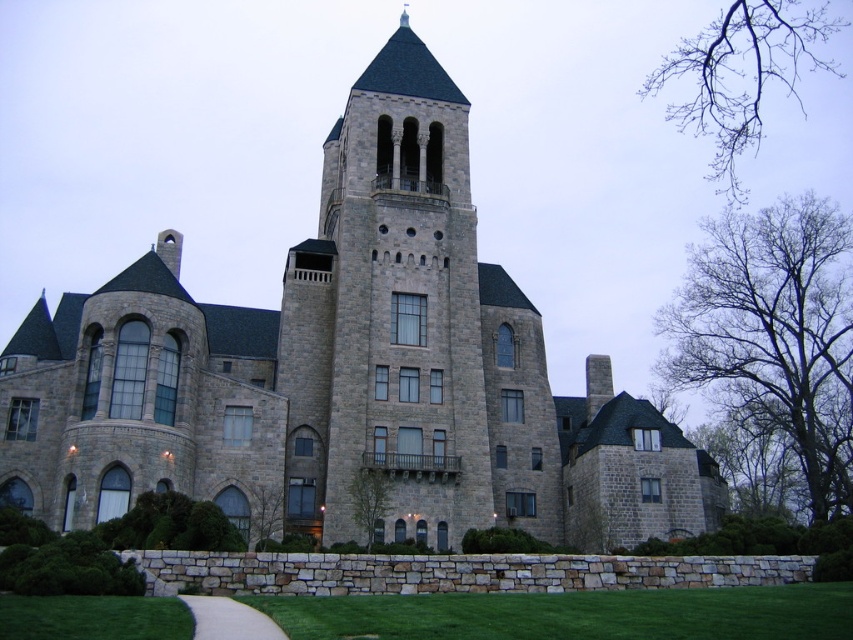
Is point (244, 516) farther from camera compared to point (405, 397)?

No, (244, 516) is closer to viewer.

Does gray stone castle at center appear on the right side of gray stone tower at center?

No, gray stone castle at center is not to the right of gray stone tower at center.

This screenshot has width=853, height=640. What do you see at coordinates (345, 372) in the screenshot?
I see `gray stone castle at center` at bounding box center [345, 372].

At what (x,y) coordinates should I click in order to perform the action: click on gray stone castle at center. Please return your answer as a coordinate pair (x, y). The width and height of the screenshot is (853, 640). Looking at the image, I should click on (345, 372).

Does gray stone tower at center have a smaller size compared to white gravel path at lower center?

Actually, gray stone tower at center might be larger than white gravel path at lower center.

Between point (407, 124) and point (271, 627), which one is positioned in front?

Point (271, 627)

Find the location of a particular element. This screenshot has width=853, height=640. gray stone tower at center is located at coordinates (402, 300).

Who is more distant from viewer, (631,436) or (194,634)?

Positioned behind is point (631,436).

Is gray stone castle at center positioned behind white gravel path at lower center?

Yes.

Locate an element on the screen. Image resolution: width=853 pixels, height=640 pixels. gray stone castle at center is located at coordinates coord(345,372).

Locate an element on the screen. The height and width of the screenshot is (640, 853). gray stone castle at center is located at coordinates (345, 372).